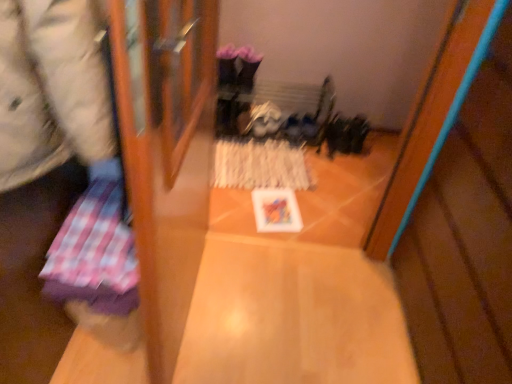
Image resolution: width=512 pixels, height=384 pixels. Find the location of `free space above wooden table at center (from a real-world perspective)`. free space above wooden table at center (from a real-world perspective) is located at coordinates (281, 313).